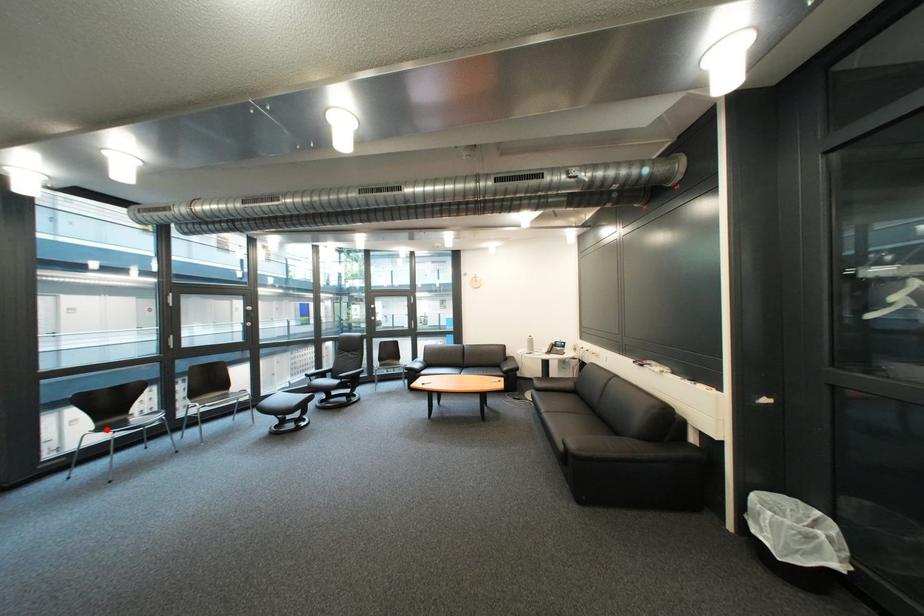
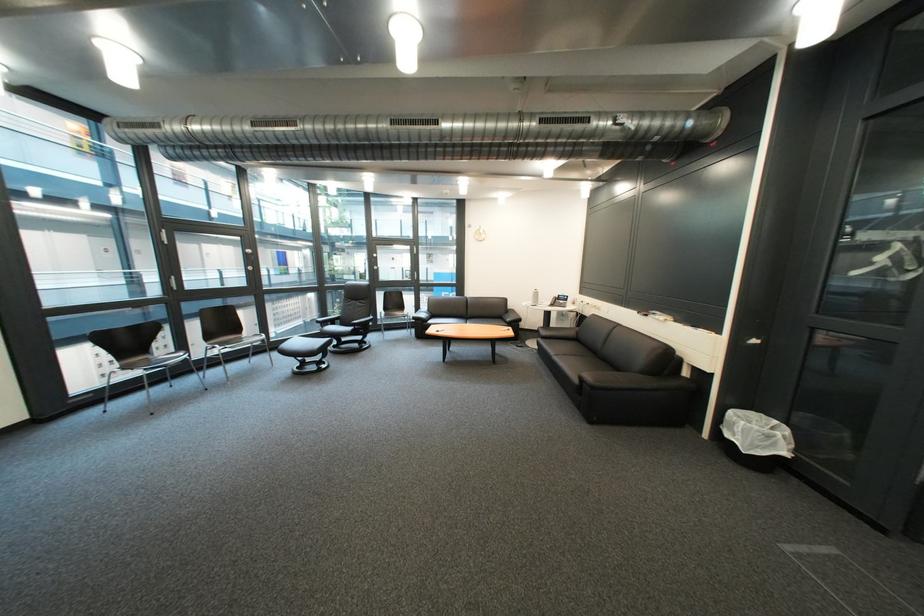
Locate, in the second image, the point that corresponds to the highlighted location in the first image.

(131, 368)